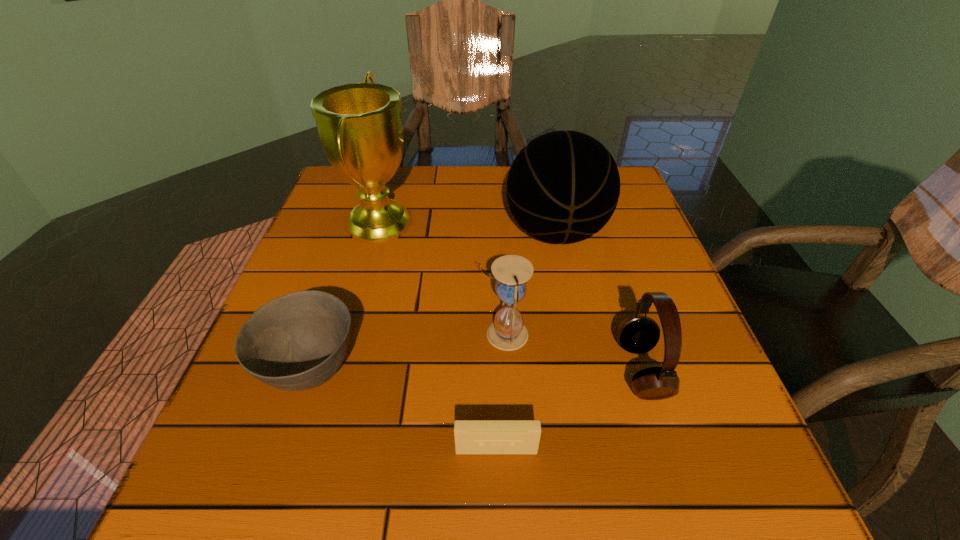
Find the location of a particular element. the tallest object is located at coordinates (360, 127).

Where is `the second tallest object`? The width and height of the screenshot is (960, 540). the second tallest object is located at coordinates (563, 187).

Locate an element on the screen. This screenshot has width=960, height=540. hourglass is located at coordinates (507, 332).

This screenshot has width=960, height=540. I want to click on the third shortest object, so click(637, 334).

Find the location of a particular element. The image size is (960, 540). the fifth tallest object is located at coordinates (298, 341).

Image resolution: width=960 pixels, height=540 pixels. Identify the location of the shortest object. (471, 436).

Find the location of a particular element. This screenshot has height=540, width=960. the nearest object is located at coordinates (471, 436).

Where is `vacant space located on the shiny surface of the tallest object`? The width and height of the screenshot is (960, 540). vacant space located on the shiny surface of the tallest object is located at coordinates (x=497, y=222).

Identify the location of vacant region located 0.390m on the left of the basketball. (342, 233).

This screenshot has width=960, height=540. I want to click on free space located 0.280m on the left of the hourglass, so click(329, 334).